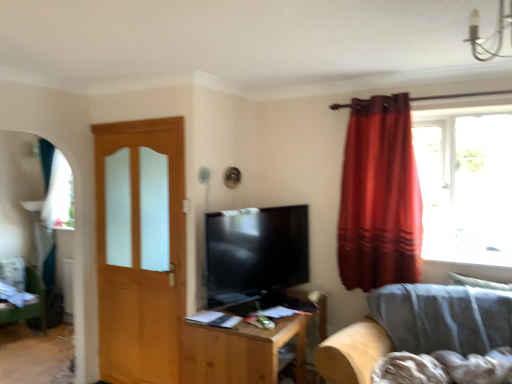
Question: Should I look upward or downward to see wooden table at center?

Choices:
 (A) down
 (B) up

Answer: (A)

Question: From the image's perspective, is satin red curtain at right located beneath wooden table at center?

Choices:
 (A) yes
 (B) no

Answer: (B)

Question: Is satin red curtain at right looking in the opposite direction of wooden table at center?

Choices:
 (A) yes
 (B) no

Answer: (B)

Question: Considering the relative sizes of satin red curtain at right and wooden table at center in the image provided, is satin red curtain at right shorter than wooden table at center?

Choices:
 (A) yes
 (B) no

Answer: (B)

Question: Is satin red curtain at right outside wooden table at center?

Choices:
 (A) no
 (B) yes

Answer: (B)

Question: Considering the relative sizes of satin red curtain at right and wooden table at center in the image provided, is satin red curtain at right bigger than wooden table at center?

Choices:
 (A) no
 (B) yes

Answer: (A)

Question: Could you tell me if satin red curtain at right is turned towards wooden table at center?

Choices:
 (A) no
 (B) yes

Answer: (A)

Question: Considering the relative positions of gray fabric couch at lower right and satin red curtain at right in the image provided, is gray fabric couch at lower right to the left of satin red curtain at right from the viewer's perspective?

Choices:
 (A) yes
 (B) no

Answer: (B)

Question: Does gray fabric couch at lower right come in front of satin red curtain at right?

Choices:
 (A) yes
 (B) no

Answer: (A)

Question: Considering the relative positions of gray fabric couch at lower right and satin red curtain at right in the image provided, is gray fabric couch at lower right to the right of satin red curtain at right from the viewer's perspective?

Choices:
 (A) yes
 (B) no

Answer: (A)

Question: Is gray fabric couch at lower right thinner than satin red curtain at right?

Choices:
 (A) yes
 (B) no

Answer: (B)

Question: Considering the relative sizes of gray fabric couch at lower right and satin red curtain at right in the image provided, is gray fabric couch at lower right shorter than satin red curtain at right?

Choices:
 (A) yes
 (B) no

Answer: (A)

Question: From a real-world perspective, is gray fabric couch at lower right located beneath satin red curtain at right?

Choices:
 (A) yes
 (B) no

Answer: (A)

Question: Is green fabric swivel chair at lower left thinner than wooden table at center?

Choices:
 (A) no
 (B) yes

Answer: (B)